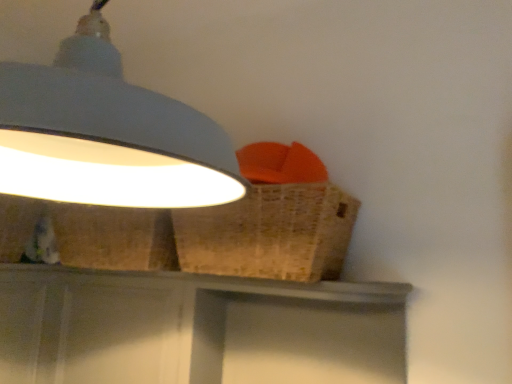
Question: Considering the positions of point (82, 72) and point (238, 253), is point (82, 72) closer or farther from the camera than point (238, 253)?

Choices:
 (A) closer
 (B) farther

Answer: (A)

Question: In terms of height, does white matte lampshade at upper left look taller or shorter compared to woven brown basket at upper right?

Choices:
 (A) tall
 (B) short

Answer: (A)

Question: Based on their relative distances, which object is nearer to the white matte lampshade at upper left?

Choices:
 (A) woven brown basket at upper right
 (B) matte gray vanity at center

Answer: (A)

Question: Considering the real-world distances, which object is farthest from the white matte lampshade at upper left?

Choices:
 (A) woven brown basket at upper right
 (B) matte gray vanity at center

Answer: (B)